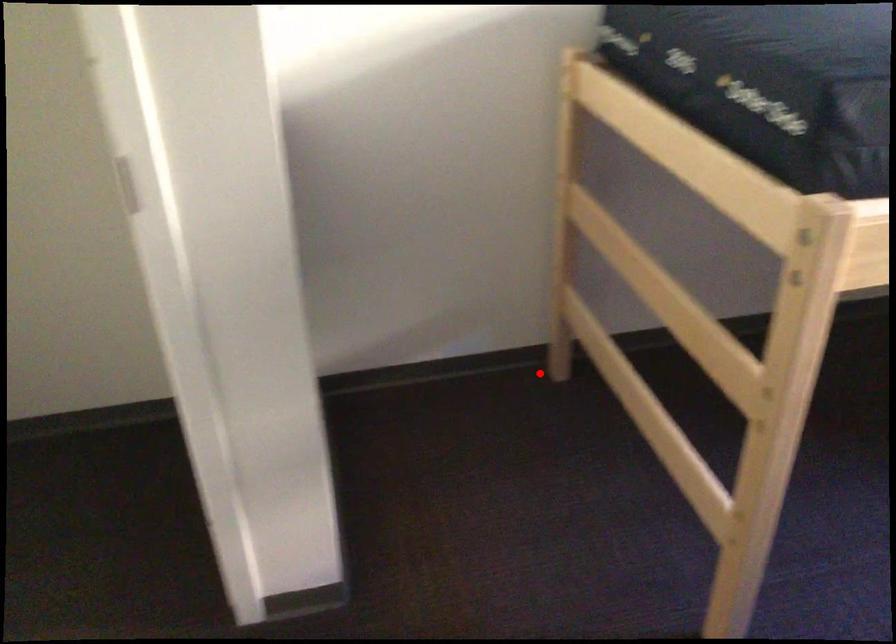
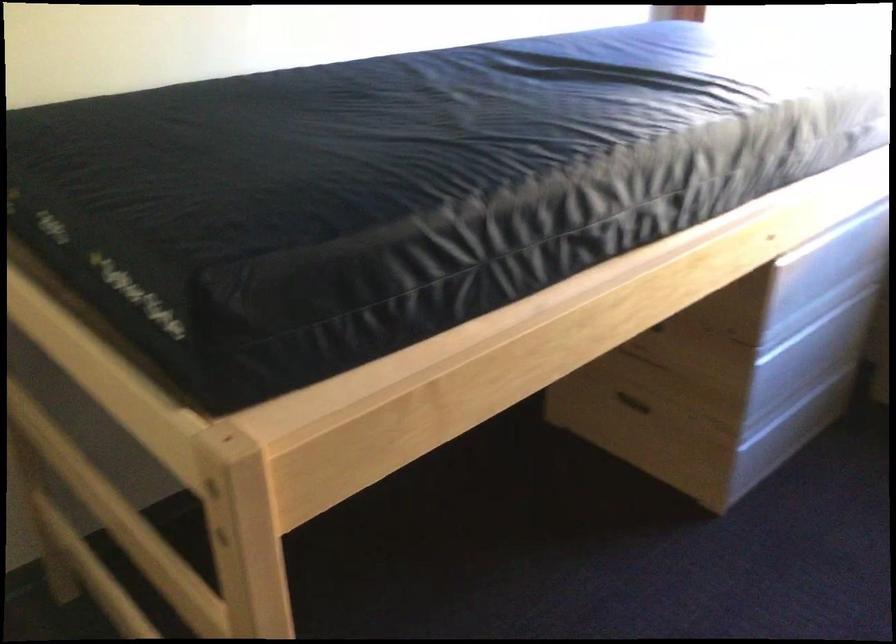
The point at the highlighted location is marked in the first image. Where is the corresponding point in the second image?

(44, 608)